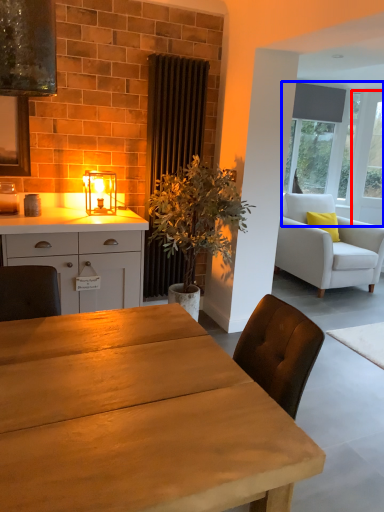
Question: Which point is further to the camera, glass door (highlighted by a red box) or window (highlighted by a blue box)?

Choices:
 (A) glass door
 (B) window

Answer: (A)